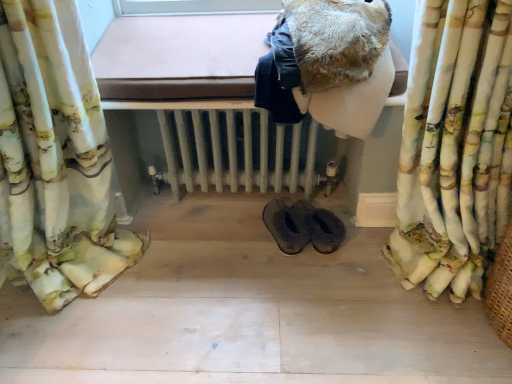
You are a GUI agent. You are given a task and a screenshot of the screen. Output one action in this format:
    pyautogui.click(x=<x>, y=<y>)
    Task: Click on the vacant space that's between fluffy fabric curtain at right and black leather slippers at center
    
    Given the screenshot: What is the action you would take?
    pyautogui.click(x=335, y=266)